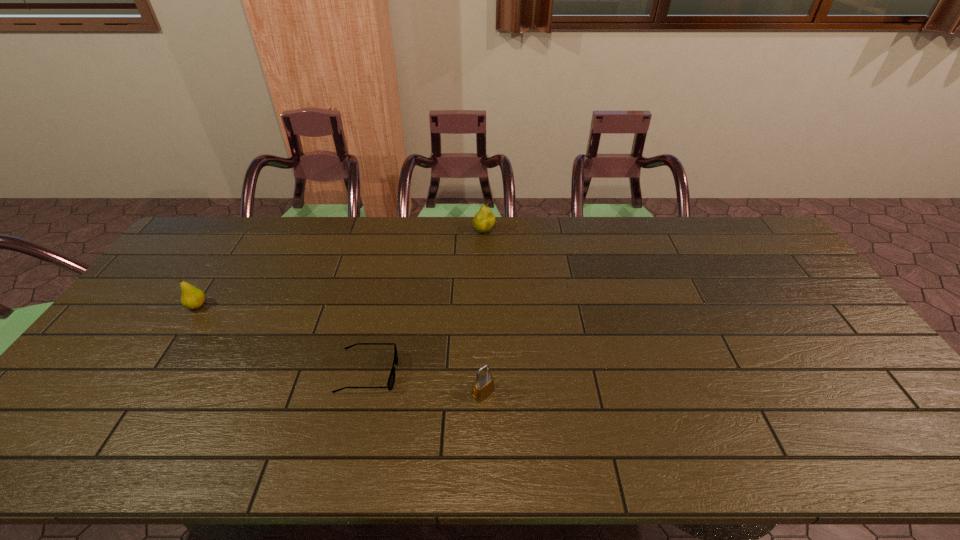
This screenshot has width=960, height=540. In order to click on vacant area in the image that satisfies the following two spatial constraints: 1. on the front side of the padlock; 2. on the right side of the second farthest object in this screenshot , I will do `click(139, 393)`.

Locate an element on the screen. Image resolution: width=960 pixels, height=540 pixels. vacant region that satisfies the following two spatial constraints: 1. on the front-facing side of the spectacles; 2. on the back side of the padlock is located at coordinates (364, 393).

Identify the location of vacant region that satisfies the following two spatial constraints: 1. on the front-facing side of the padlock; 2. on the left side of the second object from left to right. The image size is (960, 540). (364, 393).